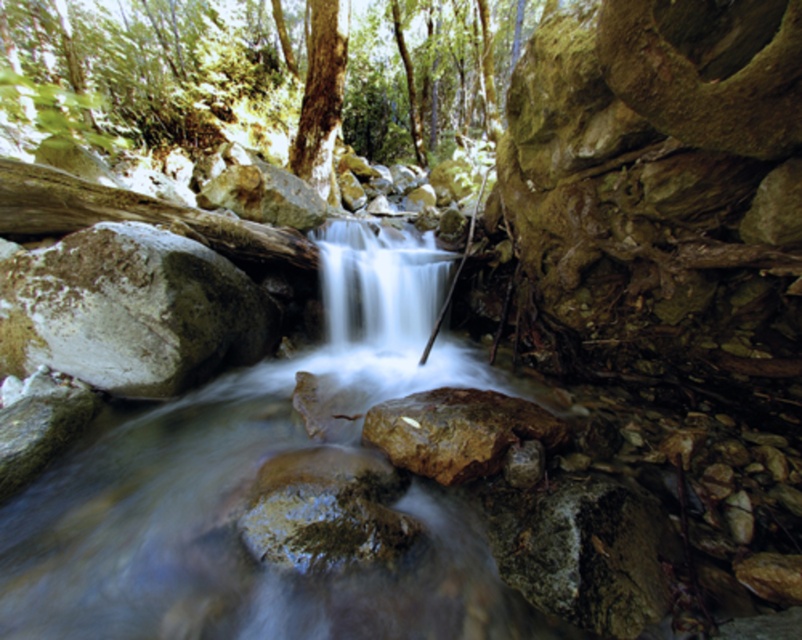
Question: Is white smooth waterfall at center wider than brown rough rock at center?

Choices:
 (A) no
 (B) yes

Answer: (B)

Question: Based on their relative distances, which object is farther from the white smooth waterfall at center?

Choices:
 (A) brown rough rock at center
 (B) brown rough rock at left
 (C) smooth bark tree at center

Answer: (C)

Question: Observing the image, what is the correct spatial positioning of brown rough rock at left in reference to brown rough rock at center?

Choices:
 (A) below
 (B) above

Answer: (B)

Question: Which of the following is the farthest from the observer?

Choices:
 (A) (476, 428)
 (B) (399, 346)
 (C) (67, 321)
 (D) (318, 172)

Answer: (D)

Question: Considering the real-world distances, which object is closest to the brown rough rock at left?

Choices:
 (A) smooth bark tree at center
 (B) white smooth waterfall at center

Answer: (B)

Question: Is white smooth waterfall at center in front of brown rough rock at center?

Choices:
 (A) no
 (B) yes

Answer: (A)